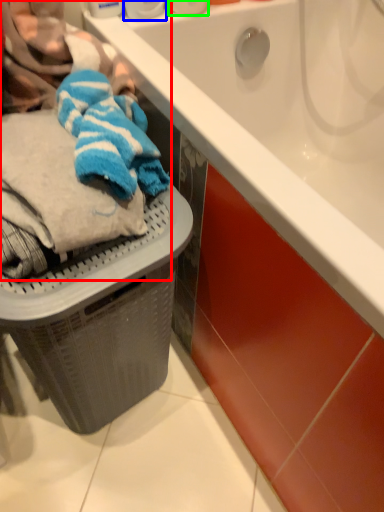
Question: Based on their relative distances, which object is farther from laundry (highlighted by a red box)? Choose from toiletry (highlighted by a blue box) and toiletry (highlighted by a green box).

Choices:
 (A) toiletry
 (B) toiletry

Answer: (B)